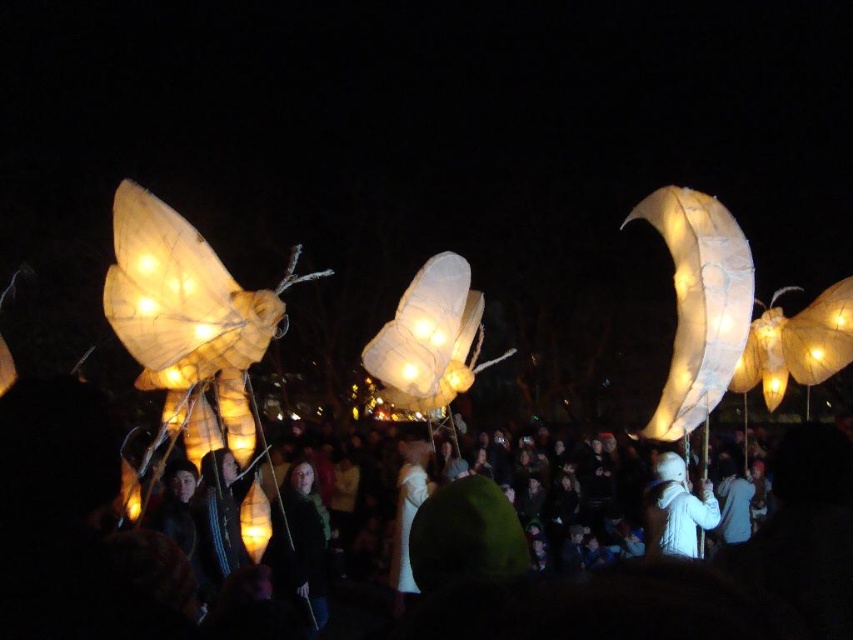
Question: Which object is positioned farthest from the white matte coat at center?

Choices:
 (A) illuminated paper crescent moon at right
 (B) white paper lanterns at center
 (C) illuminated paper lantern at center

Answer: (C)

Question: Which point is farther from the camera taking this photo?

Choices:
 (A) (659, 524)
 (B) (659, 404)
 (C) (379, 365)
 (D) (15, 416)

Answer: (A)

Question: Is illuminated paper crescent moon at right to the right of white matte coat at center from the viewer's perspective?

Choices:
 (A) no
 (B) yes

Answer: (A)

Question: Does illuminated paper crescent moon at right come behind white matte coat at center?

Choices:
 (A) yes
 (B) no

Answer: (B)

Question: Observing the image, what is the correct spatial positioning of illuminated paper crescent moon at right in reference to white matte coat at center?

Choices:
 (A) above
 (B) below

Answer: (A)

Question: Considering the real-world distances, which object is closest to the illuminated paper lantern at center?

Choices:
 (A) white matte coat at center
 (B) white paper lanterns at center

Answer: (B)